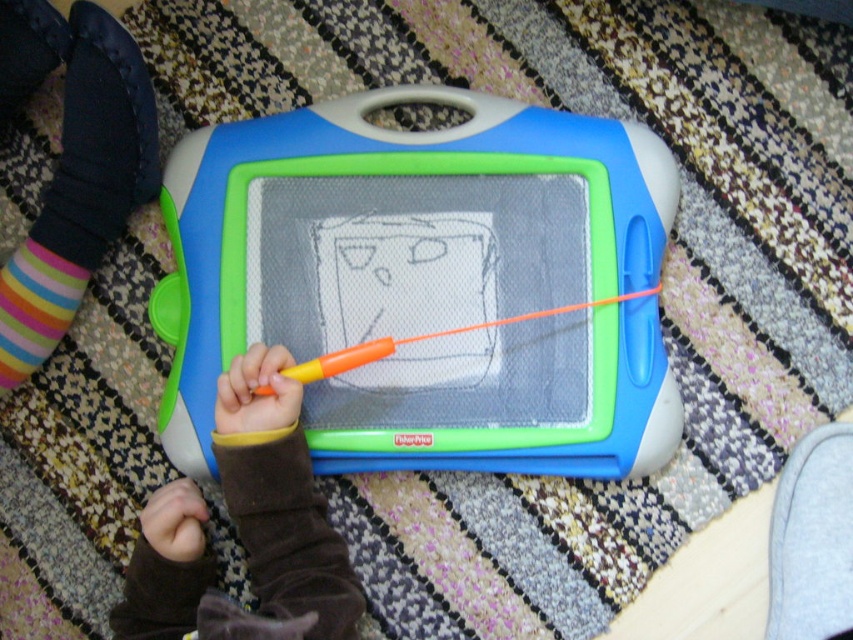
You are a robot trying to place a small sticker between the matte plastic drawing board at center and the brown velvet hand at center. Can you fit it there?

The matte plastic drawing board at center and brown velvet hand at center are 17.37 centimeters apart from each other. Since the sticker is small, it can easily fit in the space between them.

You are a robot trying to determine the best path to reach the drawing board. You have two points to consider, point [12,385] and point [32,259]. Which point is closer to you?

Point [12,385] is further to the viewer than point [32,259], so the closer point is point [32,259].

You are a toy robot that needs to place a small sticker between the multicolored striped sock at left and the multicolored striped sock at lower left. Can you fit the sticker if it is 3 inches wide?

The distance between the multicolored striped sock at left and the multicolored striped sock at lower left is 3.44 inches. Since the sticker is 3 inches wide, it can fit between them as there is enough space.